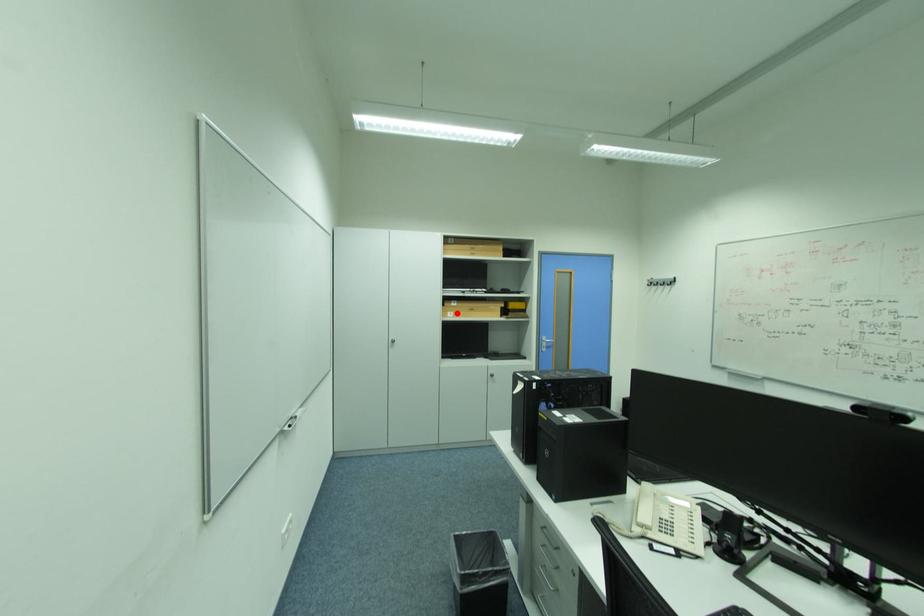
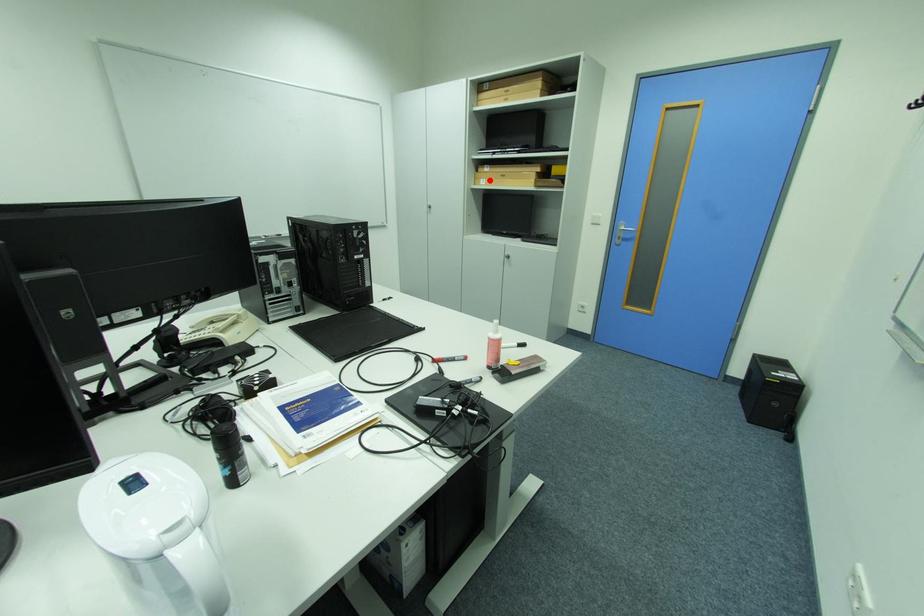
I am providing you with two images of the same scene from different viewpoints. A red point is marked on the first image and another point is marked on the second image. Is the red point in image1 aligned with the point shown in image2?

Yes